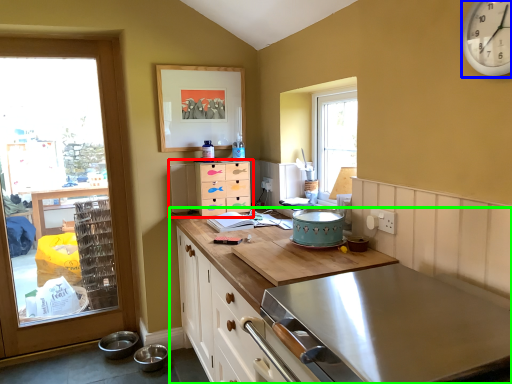
Question: Estimate the real-world distances between objects in this image. Which object is closer to chest of drawers (highlighted by a red box), clock (highlighted by a blue box) or countertop (highlighted by a green box)?

Choices:
 (A) clock
 (B) countertop

Answer: (B)